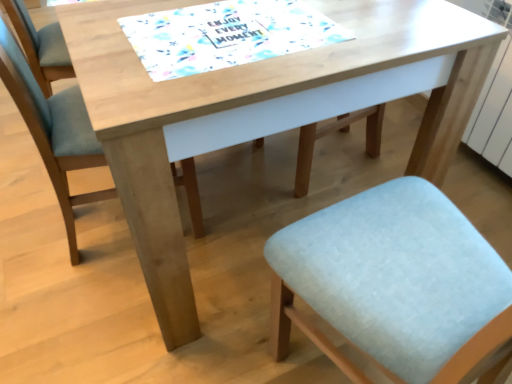
Question: Considering the positions of white paper placemat at center and light blue fabric chair at lower left in the image, is white paper placemat at center wider or thinner than light blue fabric chair at lower left?

Choices:
 (A) wide
 (B) thin

Answer: (B)

Question: Is white paper placemat at center bigger or smaller than light blue fabric chair at lower left?

Choices:
 (A) big
 (B) small

Answer: (B)

Question: Is white paper placemat at center inside the boundaries of light blue fabric chair at lower left, or outside?

Choices:
 (A) inside
 (B) outside

Answer: (B)

Question: Do you think light blue fabric chair at lower left is within white paper placemat at center, or outside of it?

Choices:
 (A) outside
 (B) inside

Answer: (A)

Question: From the image's perspective, is light blue fabric chair at lower left above or below white paper placemat at center?

Choices:
 (A) below
 (B) above

Answer: (A)

Question: Considering their positions, is light blue fabric chair at lower left located in front of or behind white paper placemat at center?

Choices:
 (A) behind
 (B) front

Answer: (A)

Question: Considering the positions of light blue fabric chair at lower left and white paper placemat at center in the image, is light blue fabric chair at lower left taller or shorter than white paper placemat at center?

Choices:
 (A) tall
 (B) short

Answer: (A)